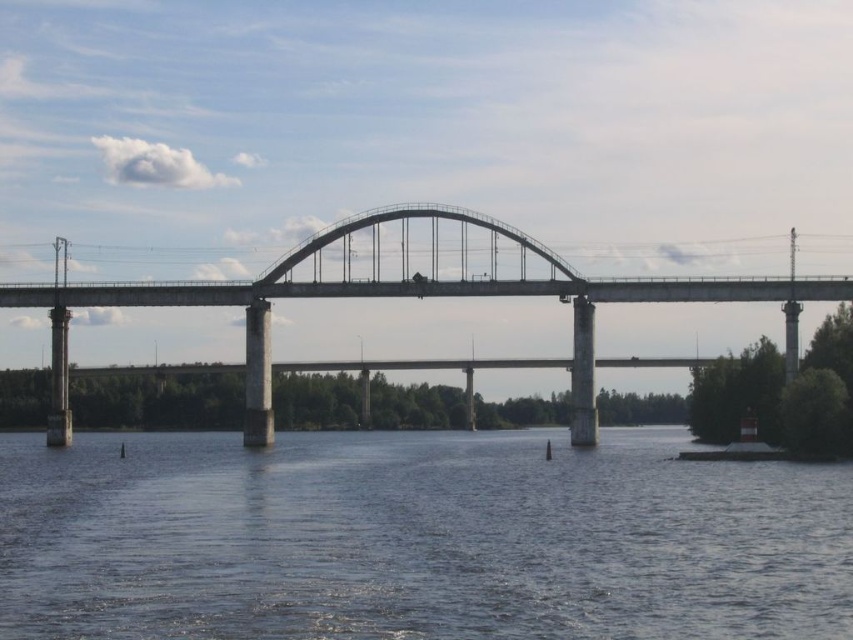
Question: Is dark blue water at center further to the viewer compared to concrete bridge at center?

Choices:
 (A) no
 (B) yes

Answer: (A)

Question: In this image, where is dark blue water at center located relative to concrete bridge at center?

Choices:
 (A) above
 (B) below

Answer: (B)

Question: Among these points, which one is farthest from the camera?

Choices:
 (A) (413, 228)
 (B) (703, 596)

Answer: (A)

Question: Which object is closer to the camera taking this photo?

Choices:
 (A) concrete bridge at center
 (B) dark blue water at center

Answer: (B)

Question: Is dark blue water at center wider than concrete bridge at center?

Choices:
 (A) yes
 (B) no

Answer: (A)